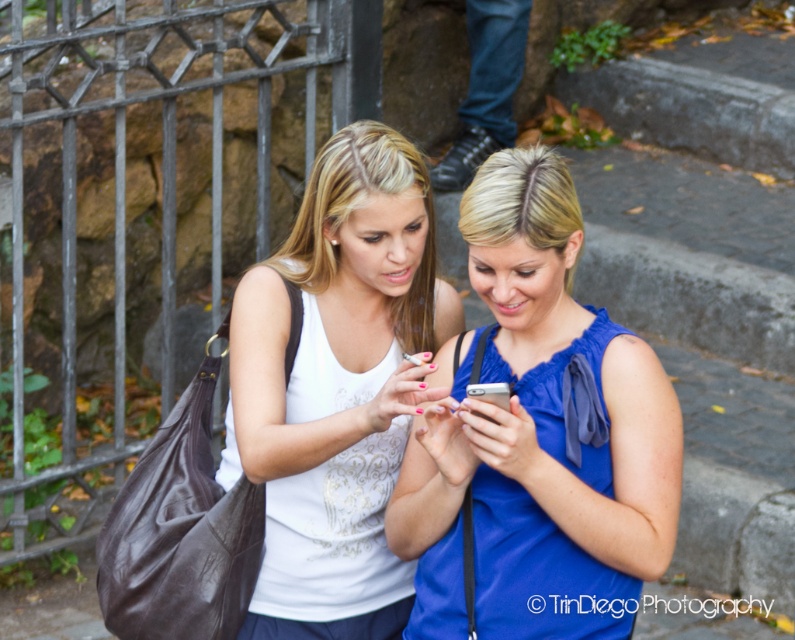
Does blue satin blouse at center have a smaller size compared to blue fabric phone at center?

No.

Is blue satin blouse at center closer to the viewer compared to blue fabric phone at center?

Yes, it is in front of blue fabric phone at center.

Measure the distance between blue satin blouse at center and camera.

A distance of 3.51 meters exists between blue satin blouse at center and camera.

Find the location of a particular element. The height and width of the screenshot is (640, 795). blue satin blouse at center is located at coordinates (538, 436).

Can you confirm if blue satin blouse at center is smaller than white satin tank top at center?

Indeed, blue satin blouse at center has a smaller size compared to white satin tank top at center.

Is blue satin blouse at center taller than white satin tank top at center?

Incorrect, blue satin blouse at center's height is not larger of white satin tank top at center's.

The image size is (795, 640). What do you see at coordinates (538, 436) in the screenshot? I see `blue satin blouse at center` at bounding box center [538, 436].

Identify the location of blue satin blouse at center. (538, 436).

Is point (365, 188) in front of point (487, 388)?

That is False.

Does white satin tank top at center have a larger size compared to silver metallic smartphone at center?

Correct, white satin tank top at center is larger in size than silver metallic smartphone at center.

Locate an element on the screen. white satin tank top at center is located at coordinates (336, 387).

The width and height of the screenshot is (795, 640). Find the location of `white satin tank top at center`. white satin tank top at center is located at coordinates (336, 387).